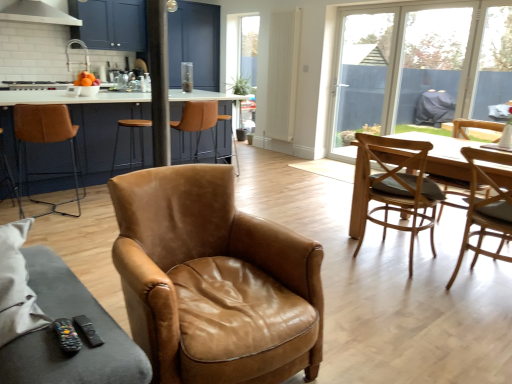
Question: From the image's perspective, relative to transparent glass door at center, which is the 1th window screen in left-to-right order, is transparent glass screen door at upper center above or below?

Choices:
 (A) above
 (B) below

Answer: (A)

Question: Considering the positions of transparent glass screen door at upper center and transparent glass door at center, which is the 1th window screen in left-to-right order, in the image, is transparent glass screen door at upper center taller or shorter than transparent glass door at center, which is the 1th window screen in left-to-right order,?

Choices:
 (A) short
 (B) tall

Answer: (A)

Question: Estimate the real-world distances between objects in this image. Which object is closer to the white glossy exhaust hood at upper left?

Choices:
 (A) transparent plastic window screen at right, the 2th window screen positioned from the left
 (B) transparent glass window at upper right, positioned as the first window screen in right-to-left order
 (C) light brown leather chair at right, which is counted as the fifth chair, starting from the left
 (D) transparent glass screen door at upper center
 (E) brown leather chair at center, the 5th chair from the right

Answer: (E)

Question: Considering the real-world distances, which object is farthest from the light brown leather chair at right, which is counted as the fifth chair, starting from the left?

Choices:
 (A) brown leather bar stool at left, arranged as the sixth chair when viewed from the right
 (B) light brown wooden chair at right, the 4th chair from the left
 (C) brown leather armchair at center, acting as the 4th chair starting from the right
 (D) white glossy exhaust hood at upper left
 (E) transparent glass window at upper right, positioned as the first window screen in right-to-left order

Answer: (D)